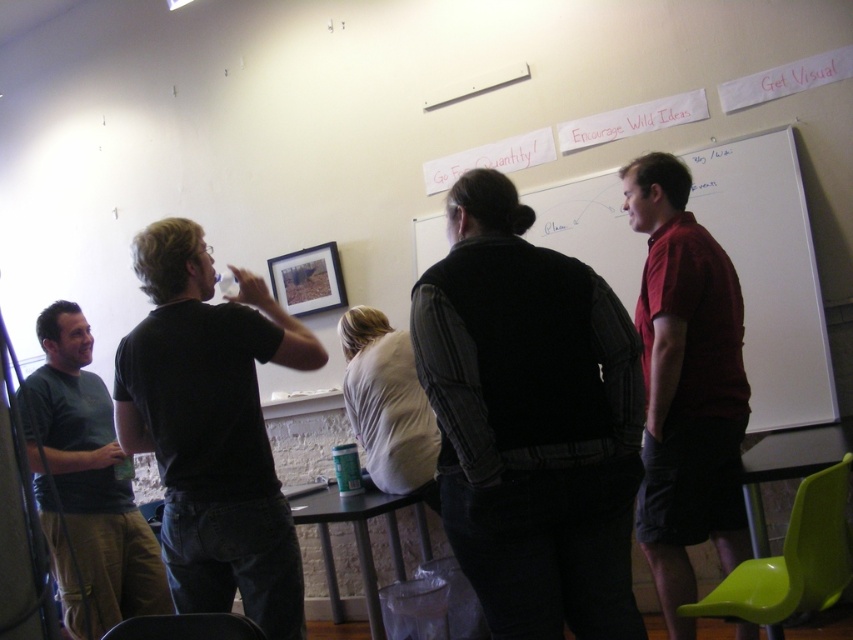
Based on the photo, you are standing in the workshop and need to locate the dark gray vest at center. What are its coordinates?

The dark gray vest at center is located at coordinates (531, 420).

You are standing in the workshop and want to take a photo of both point (556, 284) and point (107, 483). Which point will appear larger in the photo?

Point (556, 284) will appear larger in the photo because it is closer to the camera than point (107, 483).